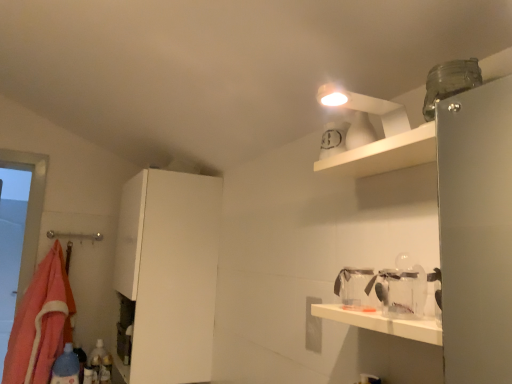
Question: Is white matte cabinet at left to the left of orange fleece blanket at left from the viewer's perspective?

Choices:
 (A) yes
 (B) no

Answer: (B)

Question: Is white matte cabinet at left looking in the opposite direction of orange fleece blanket at left?

Choices:
 (A) no
 (B) yes

Answer: (A)

Question: Does white matte cabinet at left come behind orange fleece blanket at left?

Choices:
 (A) yes
 (B) no

Answer: (B)

Question: Considering the relative sizes of white matte cabinet at left and orange fleece blanket at left in the image provided, is white matte cabinet at left wider than orange fleece blanket at left?

Choices:
 (A) yes
 (B) no

Answer: (A)

Question: Considering the relative positions of white matte cabinet at left and orange fleece blanket at left in the image provided, is white matte cabinet at left to the right of orange fleece blanket at left from the viewer's perspective?

Choices:
 (A) yes
 (B) no

Answer: (A)

Question: From the image's perspective, is blue plastic bottle at lower left above or below transparent plastic jar at lower right?

Choices:
 (A) below
 (B) above

Answer: (A)

Question: From a real-world perspective, is blue plastic bottle at lower left physically located above or below transparent plastic jar at lower right?

Choices:
 (A) below
 (B) above

Answer: (A)

Question: Does point (66, 352) appear closer or farther from the camera than point (416, 314)?

Choices:
 (A) closer
 (B) farther

Answer: (B)

Question: Looking at the image, does blue plastic bottle at lower left seem bigger or smaller compared to transparent plastic jar at lower right?

Choices:
 (A) small
 (B) big

Answer: (B)

Question: Based on their positions, is transparent plastic jar at lower right located to the left or right of white matte cabinet at left?

Choices:
 (A) right
 (B) left

Answer: (A)

Question: In terms of size, does transparent plastic jar at lower right appear bigger or smaller than white matte cabinet at left?

Choices:
 (A) small
 (B) big

Answer: (A)

Question: In terms of width, does transparent plastic jar at lower right look wider or thinner when compared to white matte cabinet at left?

Choices:
 (A) wide
 (B) thin

Answer: (B)

Question: Relative to white matte cabinet at left, is transparent plastic jar at lower right in front or behind?

Choices:
 (A) front
 (B) behind

Answer: (A)

Question: Considering the positions of point (206, 205) and point (44, 349), is point (206, 205) closer or farther from the camera than point (44, 349)?

Choices:
 (A) closer
 (B) farther

Answer: (A)

Question: Based on their sizes in the image, would you say white matte cabinet at left is bigger or smaller than orange fleece blanket at left?

Choices:
 (A) small
 (B) big

Answer: (B)